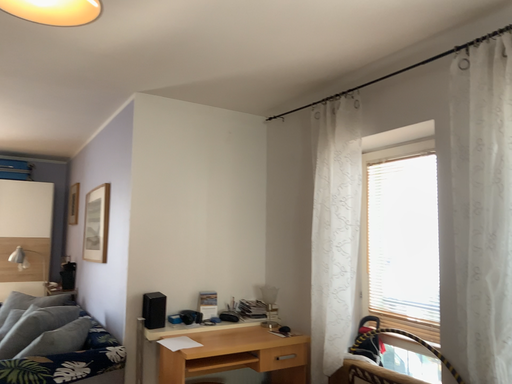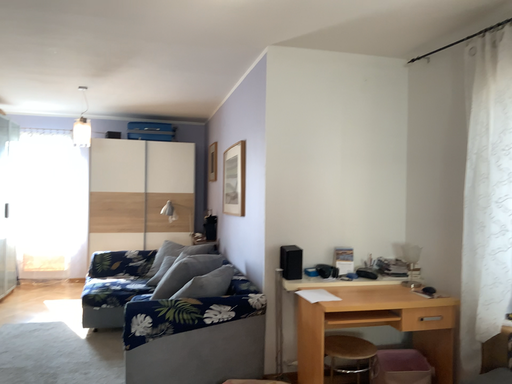
Question: Which way did the camera rotate in the video?

Choices:
 (A) rotated left
 (B) rotated right

Answer: (A)